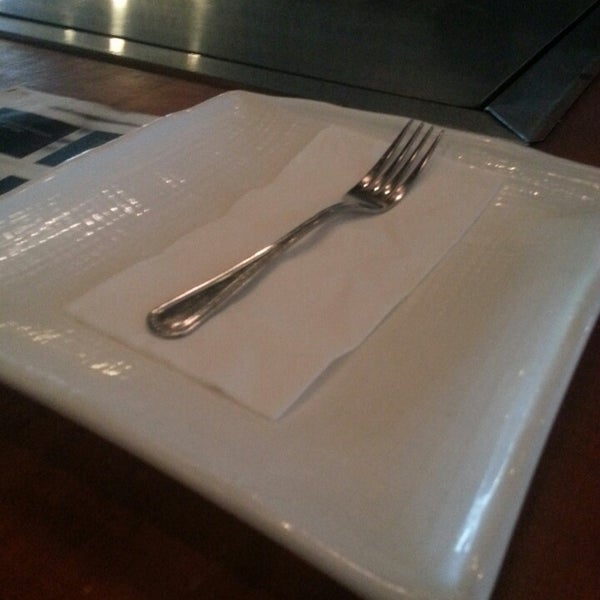
Identify the location of wooden table right of plate. This screenshot has width=600, height=600. (584, 514).